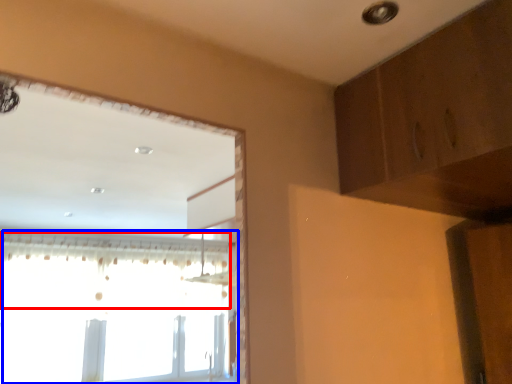
Question: Which object appears farthest to the camera in this image, curtain (highlighted by a red box) or window (highlighted by a blue box)?

Choices:
 (A) curtain
 (B) window

Answer: (B)